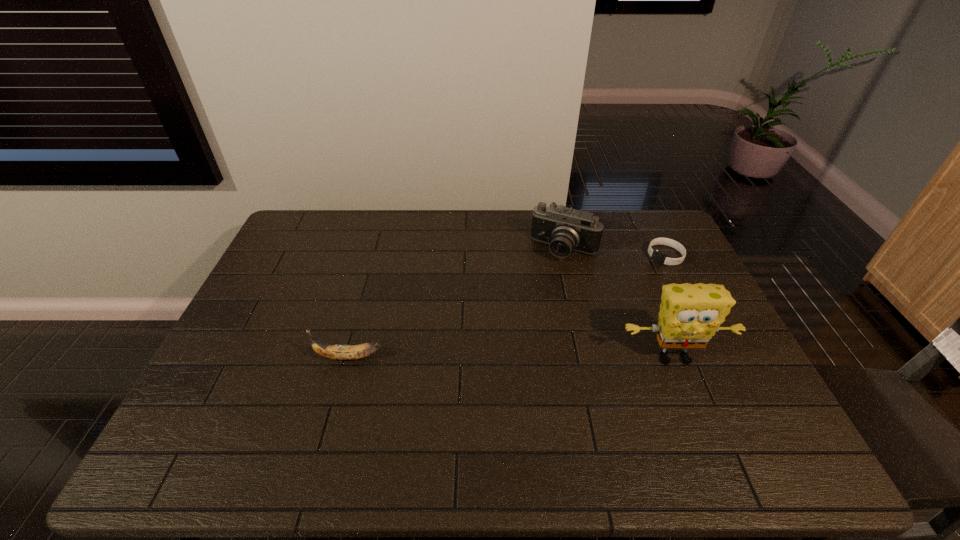
Identify the location of free space located on the front-facing side of the camera. The width and height of the screenshot is (960, 540). tap(526, 322).

This screenshot has height=540, width=960. Identify the location of free point located on the outer surface of the shortest object. (617, 297).

This screenshot has height=540, width=960. In order to click on vacant point located 0.300m on the outer surface of the shortest object in this screenshot , I will do `click(604, 308)`.

Where is `vacant space located on the outer surface of the shortest object`? vacant space located on the outer surface of the shortest object is located at coordinates (598, 314).

In order to click on camera that is at the far edge in this screenshot , I will do `click(565, 229)`.

Where is `wristband that is at the far edge`? wristband that is at the far edge is located at coordinates (660, 258).

You are a GUI agent. You are given a task and a screenshot of the screen. Output one action in this format:
    pyautogui.click(x=<x>, y=<y>)
    Task: Click on the sponge located in the right edge section of the desktop
    This screenshot has width=960, height=540.
    Given the screenshot: What is the action you would take?
    pyautogui.click(x=690, y=314)

Locate an element on the screen. This screenshot has height=540, width=960. wristband at the right edge is located at coordinates (660, 258).

In order to click on object positioned at the far right corner in this screenshot , I will do `click(660, 258)`.

The height and width of the screenshot is (540, 960). In the image, there is a desktop. In order to click on free region at the far edge in this screenshot , I will do `click(352, 222)`.